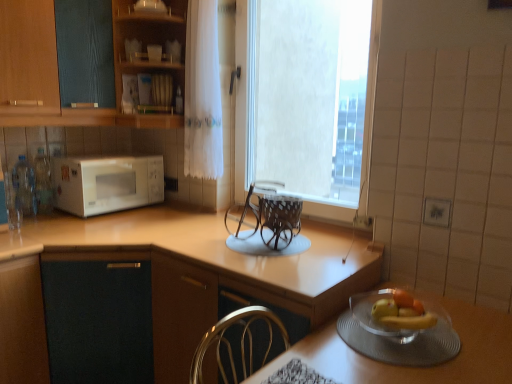
What are the coordinates of `free space in front of clear glass bottle at left, which is the second bottle from left to right` in the screenshot? It's located at (42, 221).